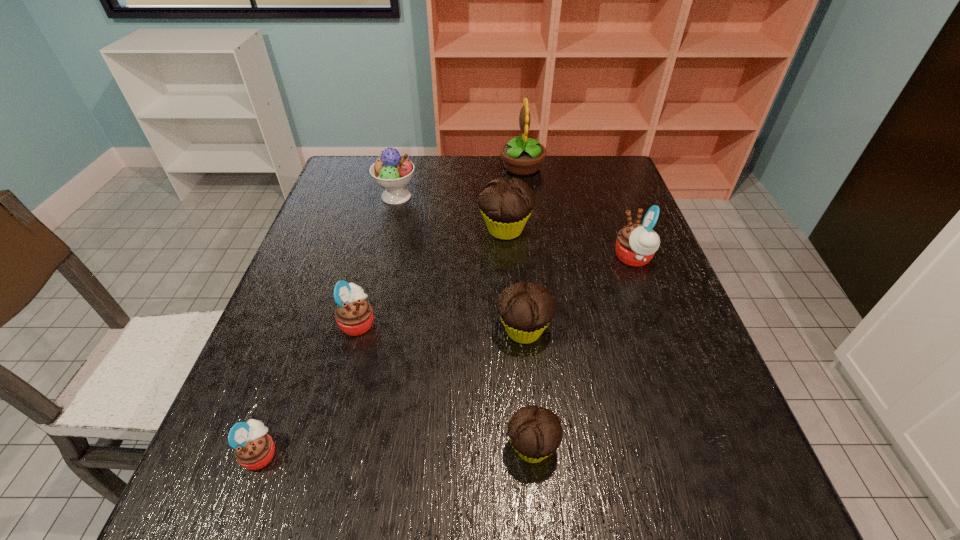
Where is `vacant space in between the rightmost object and the biggest chocolate muffin`? This screenshot has height=540, width=960. vacant space in between the rightmost object and the biggest chocolate muffin is located at coordinates (569, 244).

Find the location of a particular element. Image resolution: width=960 pixels, height=540 pixels. vacant space that is in between the nearest chocolate muffin and the leftmost muffin is located at coordinates (396, 450).

Locate an element on the screen. The width and height of the screenshot is (960, 540). free area in between the biggest chocolate muffin and the second biggest pink muffin is located at coordinates (432, 276).

Image resolution: width=960 pixels, height=540 pixels. What are the coordinates of `vacant area that lies between the second nearest chocolate muffin and the rightmost muffin` in the screenshot? It's located at (579, 294).

You are a GUI agent. You are given a task and a screenshot of the screen. Output one action in this format:
    pyautogui.click(x=<x>, y=<y>)
    Task: Click on the vacant space in between the second pink muffin from left to right and the nearest chocolate muffin
    This screenshot has height=540, width=960.
    Given the screenshot: What is the action you would take?
    pyautogui.click(x=445, y=385)

Choose which object is the third nearest neighbor to the icecream. Please provide its 2D coordinates. Your answer should be formatted as a tuple, i.e. [(x, y)], where the tuple contains the x and y coordinates of a point satisfying the conditions above.

[(354, 315)]

The width and height of the screenshot is (960, 540). I want to click on object that stands as the third closest to the smallest chocolate muffin, so click(254, 449).

Select which muffin is the third closest to the biggest chocolate muffin. Please provide its 2D coordinates. Your answer should be formatted as a tuple, i.e. [(x, y)], where the tuple contains the x and y coordinates of a point satisfying the conditions above.

[(354, 315)]

Identify which muffin is located as the third nearest to the second biggest pink muffin. Please provide its 2D coordinates. Your answer should be formatted as a tuple, i.e. [(x, y)], where the tuple contains the x and y coordinates of a point satisfying the conditions above.

[(506, 205)]

Find the location of a particular element. This screenshot has width=960, height=540. pink muffin that is the closest to the leftmost pink muffin is located at coordinates (354, 315).